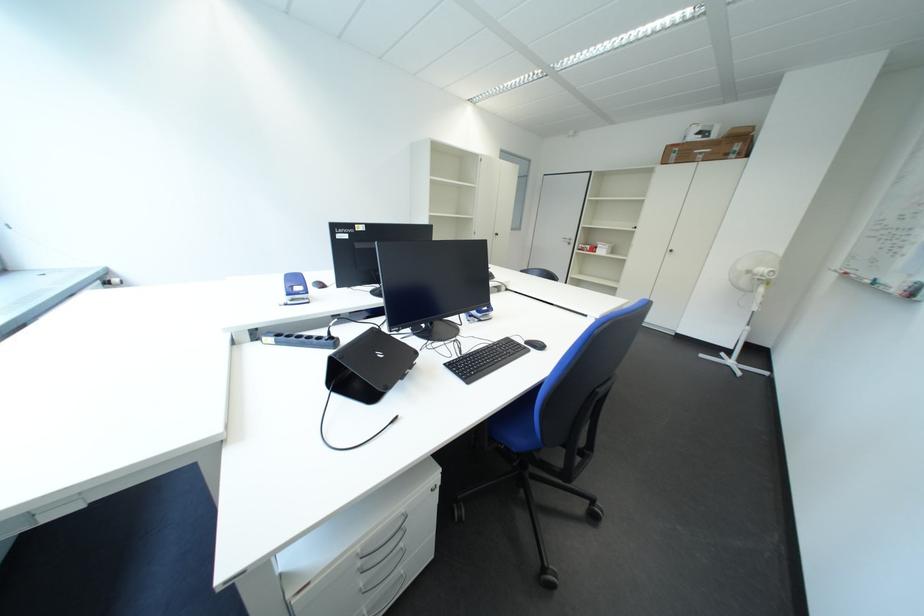
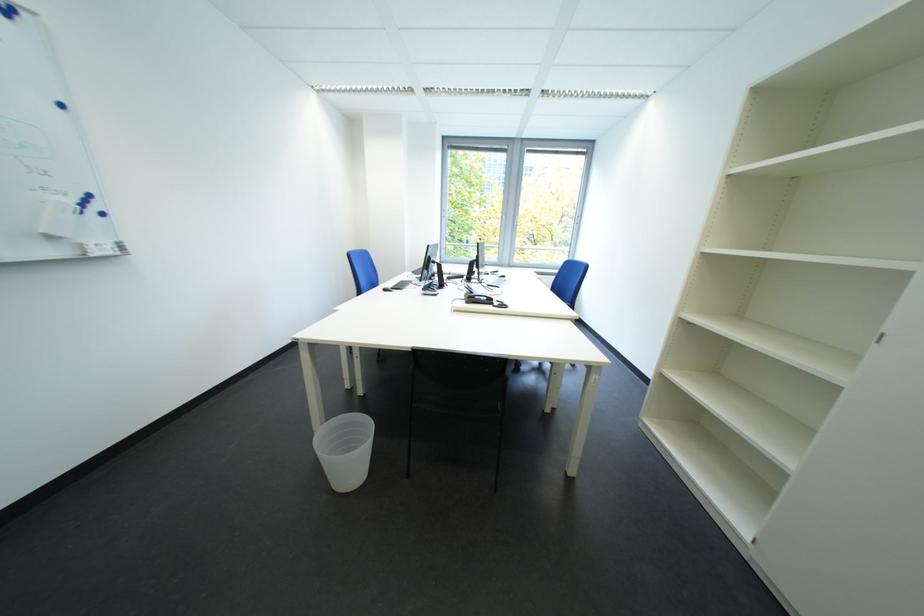
Question: I am providing you with two images of the same scene from different viewpoints. Which of the following objects are not visible in image2?

Choices:
 (A) chair sitting surface
 (B) phone handset
 (C) whiteboard marker
 (D) black spice shaker

Answer: (A)